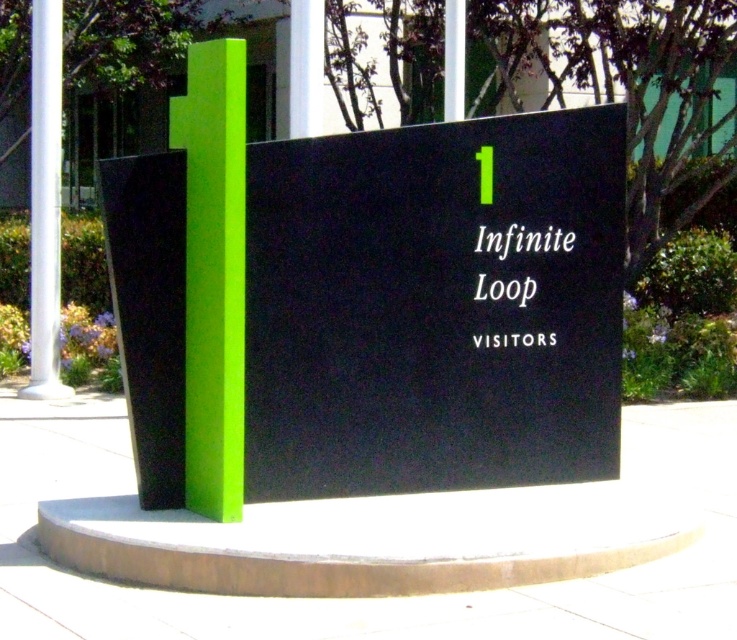
Question: Which point is farther from the camera taking this photo?

Choices:
 (A) (38, 220)
 (B) (722, 611)
 (C) (458, 36)

Answer: (C)

Question: Is concrete at center wider than white glossy pole at upper center?

Choices:
 (A) no
 (B) yes

Answer: (B)

Question: Does matte black sign at center come behind concrete at center?

Choices:
 (A) yes
 (B) no

Answer: (A)

Question: Considering the relative positions of matte black sign at center and white smooth pole at left in the image provided, where is matte black sign at center located with respect to white smooth pole at left?

Choices:
 (A) above
 (B) below

Answer: (B)

Question: Which object is farther from the camera taking this photo?

Choices:
 (A) lime green plastic pillar at left
 (B) whitematerial/textureinfinite loopobject at center
 (C) white smooth pole at left

Answer: (C)

Question: Among these points, which one is nearest to the camera?

Choices:
 (A) (45, 289)
 (B) (198, 106)

Answer: (B)